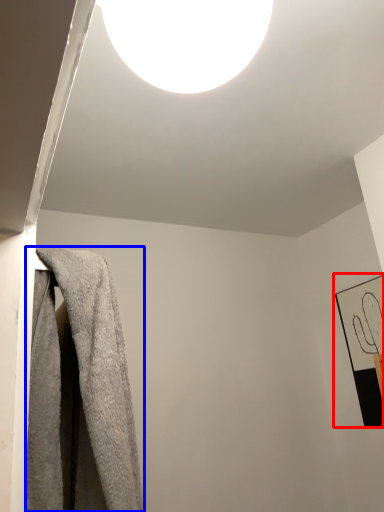
Question: Among these objects, which one is nearest to the camera, picture frame (highlighted by a red box) or towel (highlighted by a blue box)?

Choices:
 (A) picture frame
 (B) towel

Answer: (B)